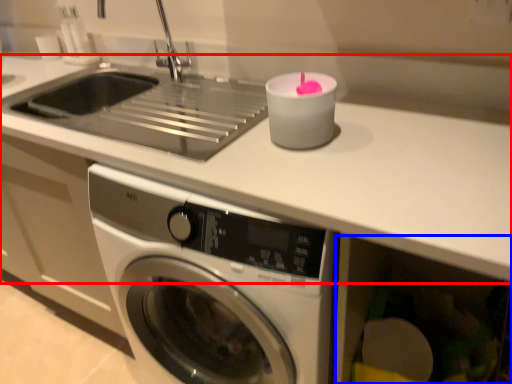
Question: Which of the following is the farthest to the observer, counter top (highlighted by a red box) or drawer (highlighted by a blue box)?

Choices:
 (A) counter top
 (B) drawer

Answer: (B)